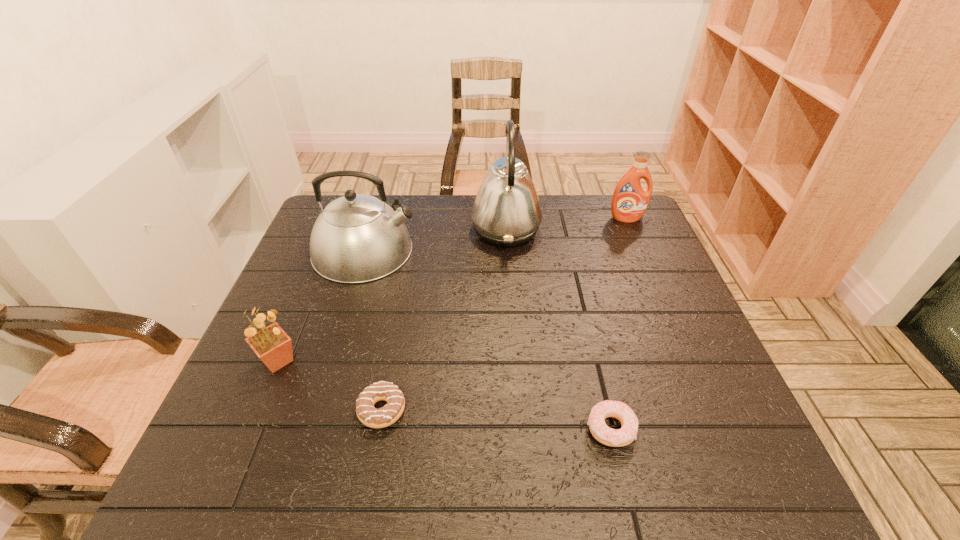
This screenshot has width=960, height=540. Identify the location of the fourth object from left to right. (506, 212).

Find the location of a particular element. the right kettle is located at coordinates (506, 212).

Identify the location of the left kettle. The image size is (960, 540). (357, 238).

Locate an element on the screen. The image size is (960, 540). the third tallest object is located at coordinates (629, 202).

I want to click on detergent, so click(629, 202).

Find the location of a particular element. The height and width of the screenshot is (540, 960). the fourth tallest object is located at coordinates (273, 346).

Locate an element on the screen. Image resolution: width=960 pixels, height=540 pixels. sunflower is located at coordinates (273, 346).

At what (x,y) coordinates should I click in order to perform the action: click on the second object from right to left. Please return your answer as a coordinate pair (x, y). The image size is (960, 540). Looking at the image, I should click on (601, 432).

Locate an element on the screen. The height and width of the screenshot is (540, 960). the left doughnut is located at coordinates (370, 416).

This screenshot has width=960, height=540. I want to click on blank space located 0.400m from the spout of the right kettle, so click(341, 229).